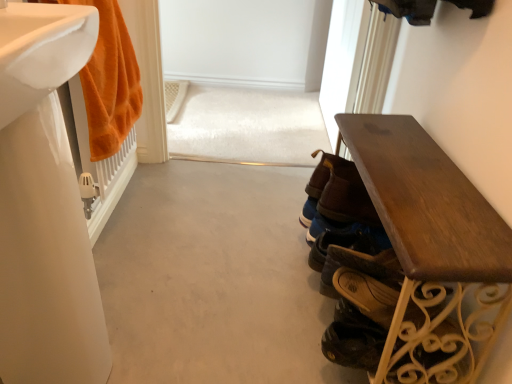
You are a GUI agent. You are given a task and a screenshot of the screen. Output one action in this format:
    pyautogui.click(x=<x>, y=<y>)
    Task: Click on the vacant point above brown leather shoe at lower right, which is counted as the 1th shoe, starting from the top (from a real-world perspective)
    
    Given the screenshot: What is the action you would take?
    [373, 269]